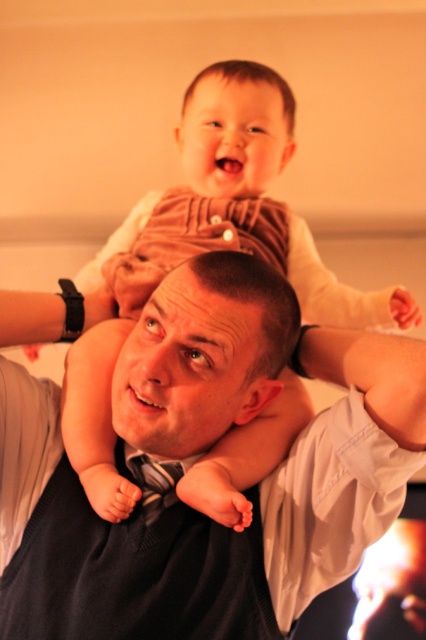
You are a fashion designer analyzing the image. You need to determine if the matte black shirt at center can be paired with the brown corduroy pants at upper center based on their widths. Which one is wider?

The brown corduroy pants at upper center is wider than the matte black shirt at center, so they can be paired together as the pants are wider.

You are a photographer adjusting the focus of your camera. The scene shows an adult carrying a child on their shoulders. You need to ensure both the brown corduroy pants at upper center and the silky black tie at center are in focus. Given their sizes, which object should you prioritize focusing on first to ensure clarity?

The brown corduroy pants at upper center is larger in size than the silky black tie at center, so you should prioritize focusing on the brown corduroy pants at upper center first to ensure clarity since larger objects require more precise focus adjustments.